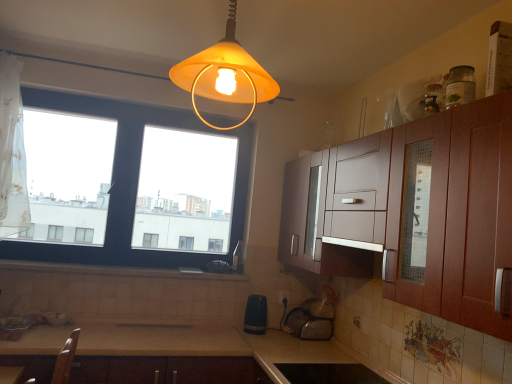
Find the location of a particular element. The image size is (512, 384). black matte stove at lower center, the 4th appliance in the top-to-bottom sequence is located at coordinates (329, 373).

What do you see at coordinates (329, 373) in the screenshot? I see `black matte stove at lower center, the 4th appliance in the top-to-bottom sequence` at bounding box center [329, 373].

In order to click on matte yellow glass lampshade at upper center in this screenshot , I will do `click(225, 74)`.

The width and height of the screenshot is (512, 384). Describe the element at coordinates (132, 184) in the screenshot. I see `transparent glass window at left` at that location.

Image resolution: width=512 pixels, height=384 pixels. What do you see at coordinates (256, 315) in the screenshot?
I see `black plastic toaster at lower center, placed as the third appliance when sorted from bottom to top` at bounding box center [256, 315].

How much space does clear glass jar at upper right, which ranks as the fourth appliance in back-to-front order, occupy horizontally?

3.26 inches.

Locate an element on the screen. clear glass jar at upper right, which ranks as the fourth appliance in back-to-front order is located at coordinates (460, 86).

In order to click on matte white electric outlet at lower center in this screenshot , I will do `click(283, 296)`.

In order to click on white tile at lower center in this screenshot , I will do `click(115, 271)`.

Is beige laminate countertop at lower center in contact with metallic silver sink at lower center, placed as the second appliance when sorted from bottom to top?

No, beige laminate countertop at lower center is not beside metallic silver sink at lower center, placed as the second appliance when sorted from bottom to top.

Does point (28, 356) come behind point (308, 301)?

No, (28, 356) is in front of (308, 301).

From the image's perspective, relative to metallic silver sink at lower center, placed as the second appliance when sorted from bottom to top, is beige laminate countertop at lower center above or below?

From the image's perspective, beige laminate countertop at lower center appears below metallic silver sink at lower center, placed as the second appliance when sorted from bottom to top.

Considering the relative positions of beige laminate countertop at lower center and metallic silver sink at lower center, which is the fourth appliance from front to back, in the image provided, is beige laminate countertop at lower center to the right of metallic silver sink at lower center, which is the fourth appliance from front to back, from the viewer's perspective?

No, beige laminate countertop at lower center is not to the right of metallic silver sink at lower center, which is the fourth appliance from front to back.

Who is shorter, white tile at lower center or black matte stove at lower center, the 2th appliance positioned from the front?

With less height is white tile at lower center.

Identify the location of window sill on the left of black matte stove at lower center, the 4th appliance in the top-to-bottom sequence. (115, 271).

Looking at the image, does white tile at lower center seem bigger or smaller compared to black matte stove at lower center, marked as the first appliance in a bottom-to-top arrangement?

Clearly, white tile at lower center is larger in size than black matte stove at lower center, marked as the first appliance in a bottom-to-top arrangement.

From the image's perspective, would you say white tile at lower center is positioned over black matte stove at lower center, marked as the first appliance in a bottom-to-top arrangement?

Indeed, from the image's perspective, white tile at lower center is shown above black matte stove at lower center, marked as the first appliance in a bottom-to-top arrangement.

From the image's perspective, would you say transparent glass window at left is positioned over white sheer curtain at left?

No.

Considering the positions of objects transparent glass window at left and white sheer curtain at left in the image provided, who is more to the left, transparent glass window at left or white sheer curtain at left?

Positioned to the left is white sheer curtain at left.

Is transparent glass window at left wider or thinner than white sheer curtain at left?

Considering their sizes, transparent glass window at left looks slimmer than white sheer curtain at left.

Is transparent glass window at left shorter than white sheer curtain at left?

No, transparent glass window at left is not shorter than white sheer curtain at left.

Who is taller, transparent glass window at left or metallic silver sink at lower center, placed as the second appliance when sorted from bottom to top?

Standing taller between the two is transparent glass window at left.

Considering the relative positions of transparent glass window at left and metallic silver sink at lower center, positioned as the 1th appliance in back-to-front order, in the image provided, is transparent glass window at left in front of metallic silver sink at lower center, positioned as the 1th appliance in back-to-front order,?

Yes, the depth of transparent glass window at left is less than that of metallic silver sink at lower center, positioned as the 1th appliance in back-to-front order.

Is metallic silver sink at lower center, which is the fourth appliance from front to back, a part of transparent glass window at left?

No, metallic silver sink at lower center, which is the fourth appliance from front to back, is not inside transparent glass window at left.

From a real-world perspective, does transparent glass window at left stand above metallic silver sink at lower center, which is the fourth appliance from front to back?

Correct, in the physical world, transparent glass window at left is higher than metallic silver sink at lower center, which is the fourth appliance from front to back.

Between white tile at lower center and transparent glass window at left, which one has more height?

transparent glass window at left.

From the image's perspective, which is above, white tile at lower center or transparent glass window at left?

transparent glass window at left.

Considering the relative positions of white tile at lower center and transparent glass window at left in the image provided, is white tile at lower center in front of transparent glass window at left?

Yes, white tile at lower center is closer to the viewer.

Considering the points (253, 314) and (330, 312), which point is in front, point (253, 314) or point (330, 312)?

The point (330, 312) is more forward.

Can we say black plastic toaster at lower center, placed as the third appliance when sorted from bottom to top, lies outside metallic silver sink at lower center, positioned as the 1th appliance in back-to-front order?

Yes, black plastic toaster at lower center, placed as the third appliance when sorted from bottom to top, is not within metallic silver sink at lower center, positioned as the 1th appliance in back-to-front order.

From the image's perspective, is black plastic toaster at lower center, which is counted as the second appliance, starting from the back, on top of metallic silver sink at lower center, which is the fourth appliance from front to back?

Yes, from the image's perspective, black plastic toaster at lower center, which is counted as the second appliance, starting from the back, is on top of metallic silver sink at lower center, which is the fourth appliance from front to back.

Consider the image. From a real-world perspective, between black plastic toaster at lower center, the 2th appliance viewed from the top, and metallic silver sink at lower center, which appears as the 3th appliance when viewed from the top, who is vertically higher?

black plastic toaster at lower center, the 2th appliance viewed from the top, is physically above.

In terms of width, does white sheer curtain at left look wider or thinner when compared to matte white electric outlet at lower center?

A: Considering their sizes, white sheer curtain at left looks broader than matte white electric outlet at lower center.

Is white sheer curtain at left smaller than matte white electric outlet at lower center?

Actually, white sheer curtain at left might be larger than matte white electric outlet at lower center.

Can you confirm if white sheer curtain at left is shorter than matte white electric outlet at lower center?

In fact, white sheer curtain at left may be taller than matte white electric outlet at lower center.

From a real-world perspective, is white sheer curtain at left positioned over matte white electric outlet at lower center based on gravity?

Correct, in the physical world, white sheer curtain at left is higher than matte white electric outlet at lower center.

You are a GUI agent. You are given a task and a screenshot of the screen. Output one action in this format:
    pyautogui.click(x=<x>, y=<y>)
    Task: Click on the countertop that is in front of the metallic silver sink at lower center, which is the fourth appliance from front to back
    The width and height of the screenshot is (512, 384).
    Given the screenshot: What is the action you would take?
    pyautogui.click(x=209, y=357)

Locate an element on the screen. appliance that is the 3rd one when counting downward from the white tile at lower center (from the image's perspective) is located at coordinates (329, 373).

From the image, which object appears to be nearer to metallic silver sink at lower center, positioned as the 1th appliance in back-to-front order, beige laminate countertop at lower center or matte yellow glass lampshade at upper center?

beige laminate countertop at lower center lies closer to metallic silver sink at lower center, positioned as the 1th appliance in back-to-front order, than the other object.

Which object lies nearer to the anchor point black plastic toaster at lower center, which is counted as the second appliance, starting from the back, white sheer curtain at left or white tile at lower center?

Based on the image, white tile at lower center appears to be nearer to black plastic toaster at lower center, which is counted as the second appliance, starting from the back.

Looking at this image, considering their positions, is matte white electric outlet at lower center positioned closer to transparent glass window at left than black plastic toaster at lower center, the 2th appliance viewed from the top?

Based on the image, black plastic toaster at lower center, the 2th appliance viewed from the top, appears to be nearer to transparent glass window at left.

Looking at this image, considering their positions, is metallic silver sink at lower center, which appears as the 3th appliance when viewed from the top, positioned closer to transparent glass window at left than beige laminate countertop at lower center?

beige laminate countertop at lower center.

Estimate the real-world distances between objects in this image. Which object is closer to black matte stove at lower center, the 2th appliance positioned from the front, white sheer curtain at left or metallic silver sink at lower center, which is the fourth appliance from front to back?

Based on the image, metallic silver sink at lower center, which is the fourth appliance from front to back, appears to be nearer to black matte stove at lower center, the 2th appliance positioned from the front.

Looking at the image, which one is located closer to metallic silver sink at lower center, positioned as the 1th appliance in back-to-front order, white sheer curtain at left or white tile at lower center?

white tile at lower center lies closer to metallic silver sink at lower center, positioned as the 1th appliance in back-to-front order, than the other object.

Looking at the image, which one is located further to clear glass jar at upper right, which ranks as the fourth appliance in back-to-front order, black plastic toaster at lower center, the 2th appliance viewed from the top, or white sheer curtain at left?

Based on the image, white sheer curtain at left appears to be further to clear glass jar at upper right, which ranks as the fourth appliance in back-to-front order.

Based on their spatial positions, is transparent glass window at left or matte yellow glass lampshade at upper center closer to white tile at lower center?

transparent glass window at left is closer to white tile at lower center.

Find the location of `countertop located between transparent glass window at left and black matte stove at lower center, which ranks as the third appliance in back-to-front order, in the left-right direction`. countertop located between transparent glass window at left and black matte stove at lower center, which ranks as the third appliance in back-to-front order, in the left-right direction is located at coordinates (209, 357).

You are a GUI agent. You are given a task and a screenshot of the screen. Output one action in this format:
    pyautogui.click(x=<x>, y=<y>)
    Task: Click on the window between white sheer curtain at left and metallic silver sink at lower center, placed as the second appliance when sorted from bottom to top, in the horizontal direction
    This screenshot has width=512, height=384.
    Given the screenshot: What is the action you would take?
    pyautogui.click(x=132, y=184)

Where is `window situated between white tile at lower center and black matte stove at lower center, marked as the first appliance in a bottom-to-top arrangement, from left to right`? The width and height of the screenshot is (512, 384). window situated between white tile at lower center and black matte stove at lower center, marked as the first appliance in a bottom-to-top arrangement, from left to right is located at coordinates (132, 184).

This screenshot has height=384, width=512. Identify the location of countertop located between white tile at lower center and metallic silver sink at lower center, positioned as the 1th appliance in back-to-front order, in the left-right direction. click(209, 357).